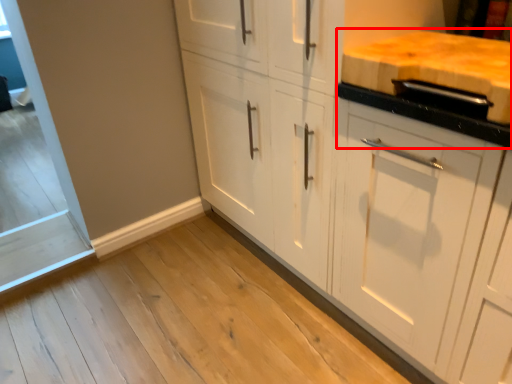
Question: Where is countertop (annotated by the red box) located in relation to cabinetry in the image?

Choices:
 (A) right
 (B) left

Answer: (A)